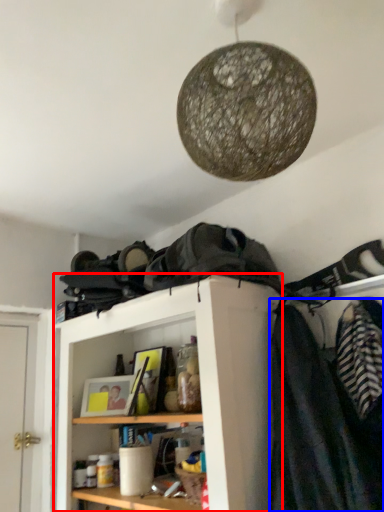
Question: Which of the following is the farthest to the observer, shelf (highlighted by a red box) or clothing (highlighted by a blue box)?

Choices:
 (A) shelf
 (B) clothing

Answer: (A)